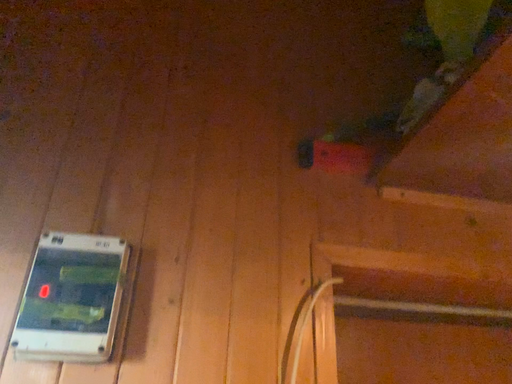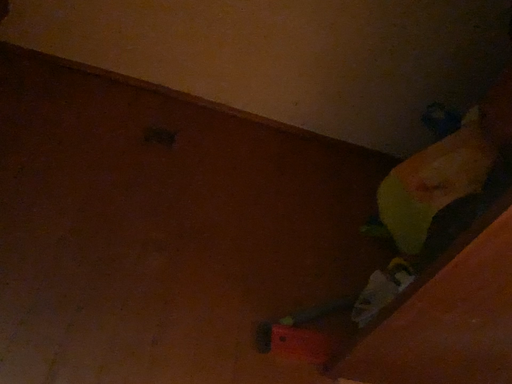
Question: How did the camera likely rotate when shooting the video?

Choices:
 (A) rotated upward
 (B) rotated downward

Answer: (A)